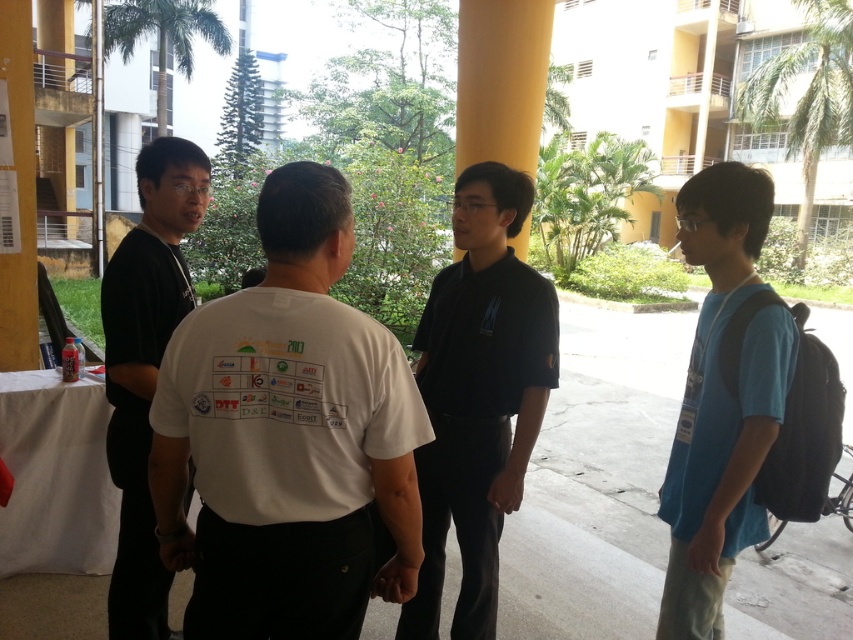
Looking at this image, you are standing at the entrance of the building and see the black matte shirt at center. If you walk straight towards the shirt, will you first encounter the covered area or the open space?

The black matte shirt at center is located at point (479, 396), which is within the covered area of the building entrance. Therefore, walking straight towards it would first lead you into the covered area before reaching the open space.